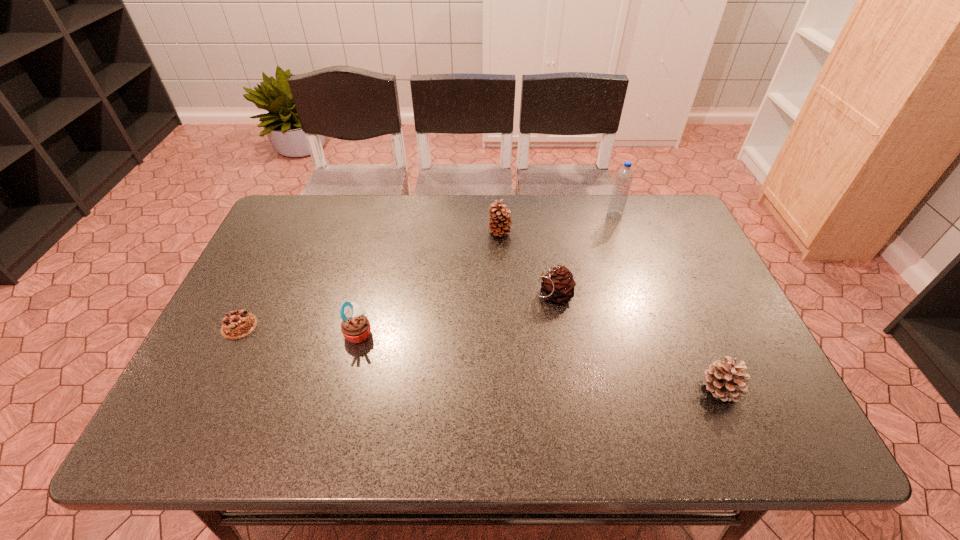
The image size is (960, 540). In order to click on free space that satisfies the following two spatial constraints: 1. with a leaf charm attached to the third farthest object; 2. on the left side of the nearest pinecone in this screenshot , I will do `click(567, 389)`.

Locate an element on the screen. Image resolution: width=960 pixels, height=540 pixels. vacant space that satisfies the following two spatial constraints: 1. on the back side of the nearest pinecone; 2. with a leaf charm attached to the third object from right to left is located at coordinates (680, 294).